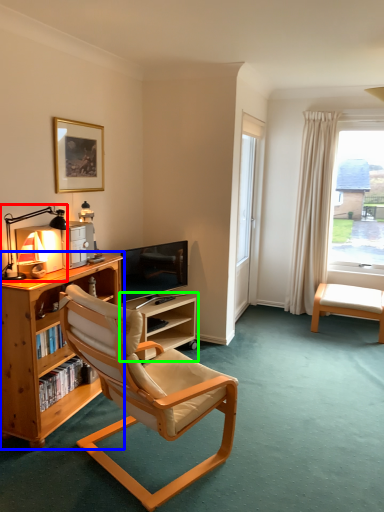
Question: Which object is positioned farthest from lamp (highlighted by a red box)? Select from bookcase (highlighted by a blue box) and shelf (highlighted by a green box).

Choices:
 (A) bookcase
 (B) shelf

Answer: (B)